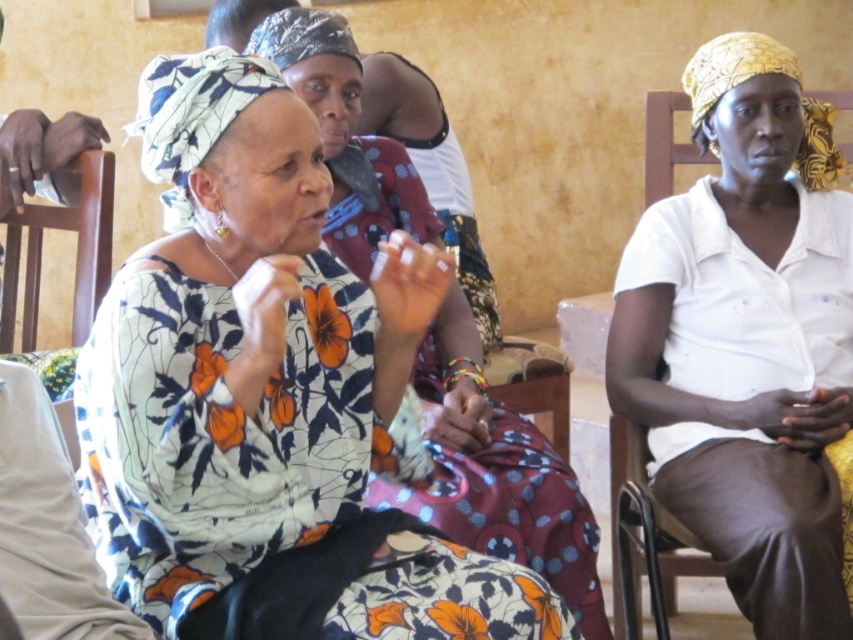
You are a photographer setting up a shoot in the scene described. You need to place a small light source between the floral print dress at center and the wooden chair at left. Based on their positions, which object should the light be closer to?

The floral print dress at center is positioned under the wooden chair at left, so the light should be placed closer to the floral print dress at center since it is directly beneath the chair.

Looking at this image, you are sitting in the wooden chair at left and want to hand a document to the person wearing the white cotton shirt at center. In which direction should you pass the document?

The white cotton shirt at center is to the right of the wooden chair at left, so you should pass the document to the right.